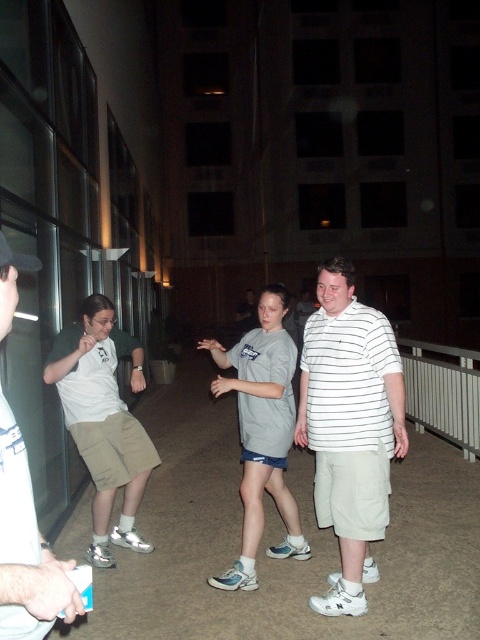
From the picture: Can you confirm if matte khaki shorts at left is taller than light brown shorts at left?

Yes.

Who is more distant from viewer, (110, 394) or (26, 630)?

The point (110, 394) is behind.

You are a GUI agent. You are given a task and a screenshot of the screen. Output one action in this format:
    pyautogui.click(x=<x>, y=<y>)
    Task: Click on the matte khaki shorts at left
    
    Given the screenshot: What is the action you would take?
    pyautogui.click(x=104, y=420)

Which is behind, point (6, 637) or point (8, 253)?

The point (8, 253) is behind.

Find the location of `light brown shorts at left`. light brown shorts at left is located at coordinates point(26,548).

Based on the photo, does white striped shirt at center have a smaller size compared to matte khaki shorts at left?

Correct, white striped shirt at center occupies less space than matte khaki shorts at left.

Who is positioned more to the left, white striped shirt at center or matte khaki shorts at left?

matte khaki shorts at left

Find the location of `white striped shirt at center`. white striped shirt at center is located at coordinates [349, 428].